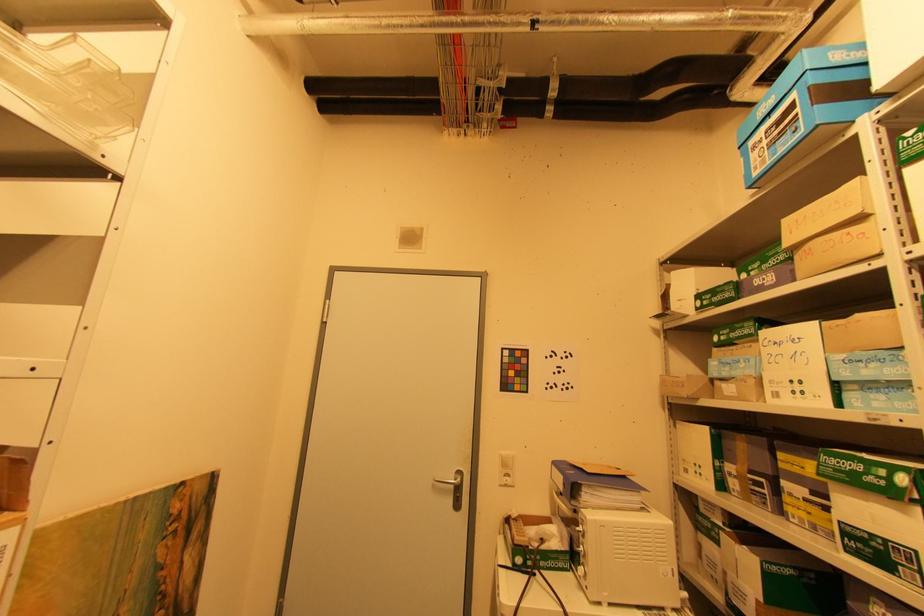
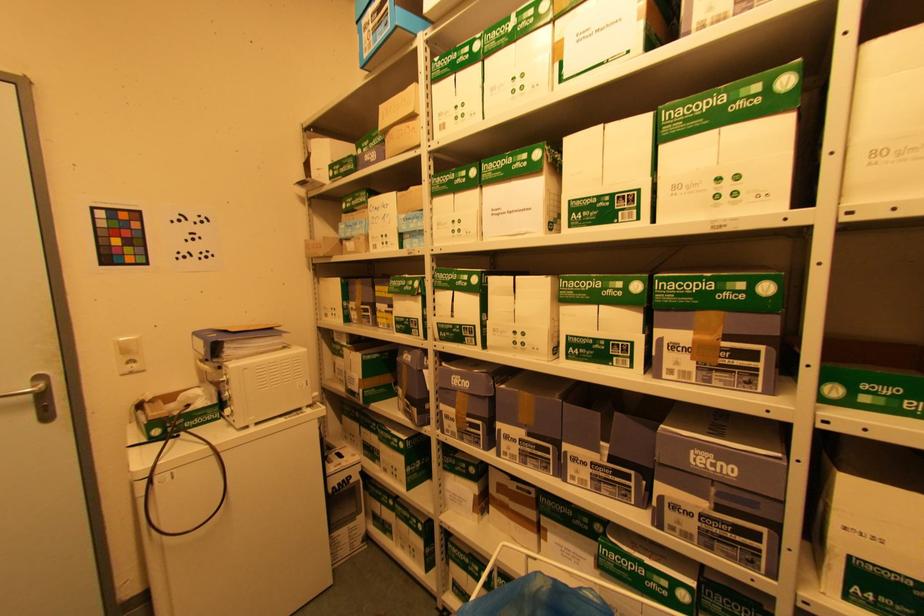
The first image is from the beginning of the video and the second image is from the end. How did the camera likely rotate when shooting the video?

The camera rotated toward right-down.